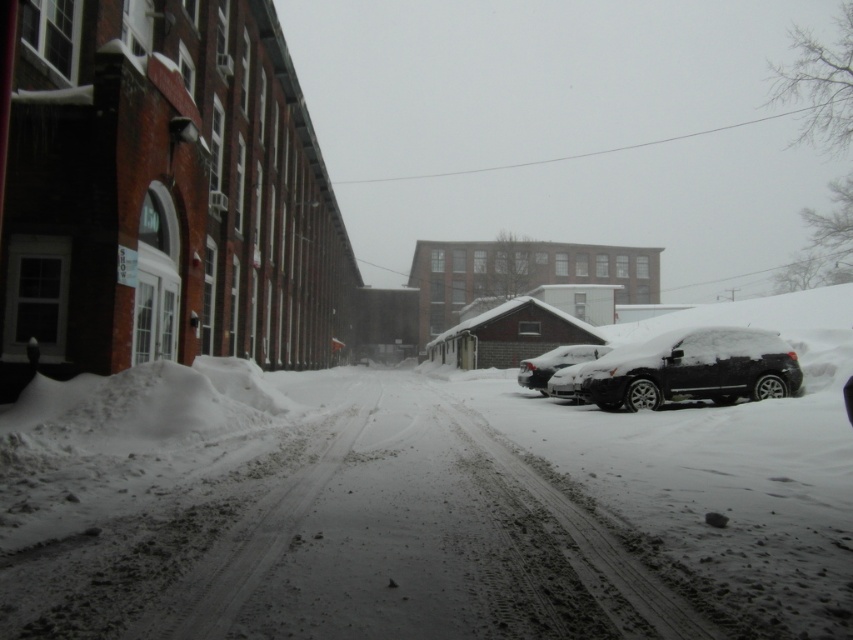
Question: Is white fluffy snow at center above snow-covered suv at right?

Choices:
 (A) no
 (B) yes

Answer: (A)

Question: Is white fluffy snow at center to the left of snow-covered suv at right from the viewer's perspective?

Choices:
 (A) no
 (B) yes

Answer: (B)

Question: Is white fluffy snow at center further to camera compared to snow-covered suv at right?

Choices:
 (A) yes
 (B) no

Answer: (B)

Question: Considering the real-world distances, which object is closest to the white fluffy snow at center?

Choices:
 (A) snow-covered suv at center
 (B) snow-covered suv at right

Answer: (A)

Question: Which object is the closest to the snow-covered suv at right?

Choices:
 (A) white fluffy snow at center
 (B) snow-covered suv at center

Answer: (B)

Question: Which of the following is the closest to the observer?

Choices:
 (A) snow-covered suv at center
 (B) white fluffy snow at center
 (C) snow-covered suv at right

Answer: (B)